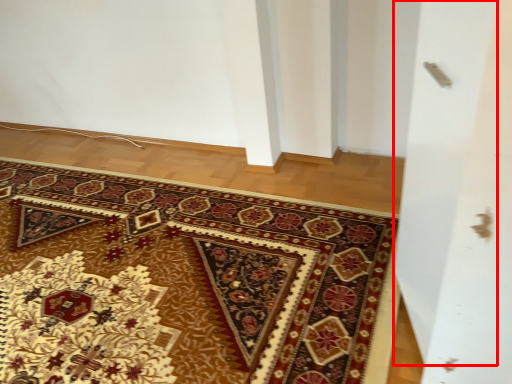
Question: From the image's perspective, where is screen door (annotated by the red box) located in relation to mat in the image?

Choices:
 (A) above
 (B) below

Answer: (A)